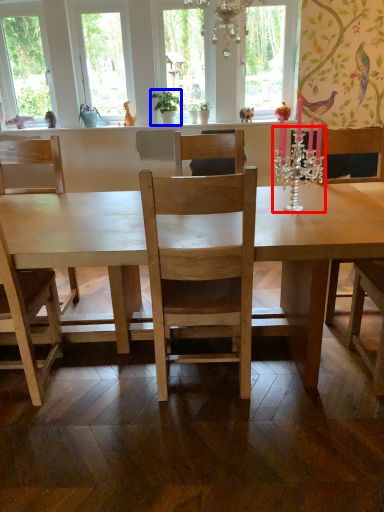
Question: Which point is further to the camera, candle holder (highlighted by a red box) or houseplant (highlighted by a blue box)?

Choices:
 (A) candle holder
 (B) houseplant

Answer: (B)